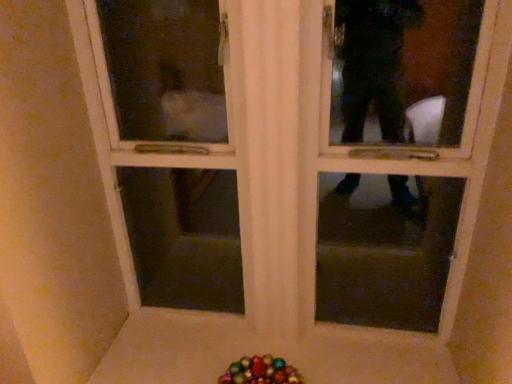
Find the location of a particular element. multicolored glass beads at lower center is located at coordinates (261, 371).

Describe the element at coordinates (261, 371) in the screenshot. This screenshot has width=512, height=384. I see `multicolored glass beads at lower center` at that location.

Find the location of a particular element. The image size is (512, 384). multicolored glass beads at lower center is located at coordinates (261, 371).